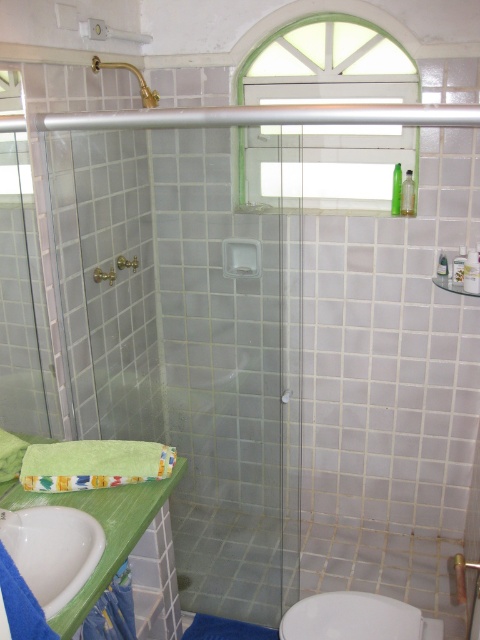
Is white glossy toilet bowl at lower right in front of blue fabric shower curtain at lower left?

No, white glossy toilet bowl at lower right is further to the viewer.

Who is more forward, (x=431, y=621) or (x=110, y=634)?

Point (x=110, y=634)

Find the location of `white glossy toilet bowl at lower right`. white glossy toilet bowl at lower right is located at coordinates (357, 618).

Measure the distance between point [60,609] and camera.

Point [60,609] is 1.30 meters away from camera.

Is point (59, 600) more distant than point (126, 61)?

No, it is in front of (126, 61).

This screenshot has width=480, height=640. What are the coordinates of `white glossy sink at lower left` in the screenshot? It's located at (52, 550).

Can you confirm if white glossy sink at lower left is bigger than white glossy toilet bowl at lower right?

Yes.

The height and width of the screenshot is (640, 480). Find the location of `white glossy sink at lower left`. white glossy sink at lower left is located at coordinates (52, 550).

Locate an element on the screen. white glossy sink at lower left is located at coordinates (52, 550).